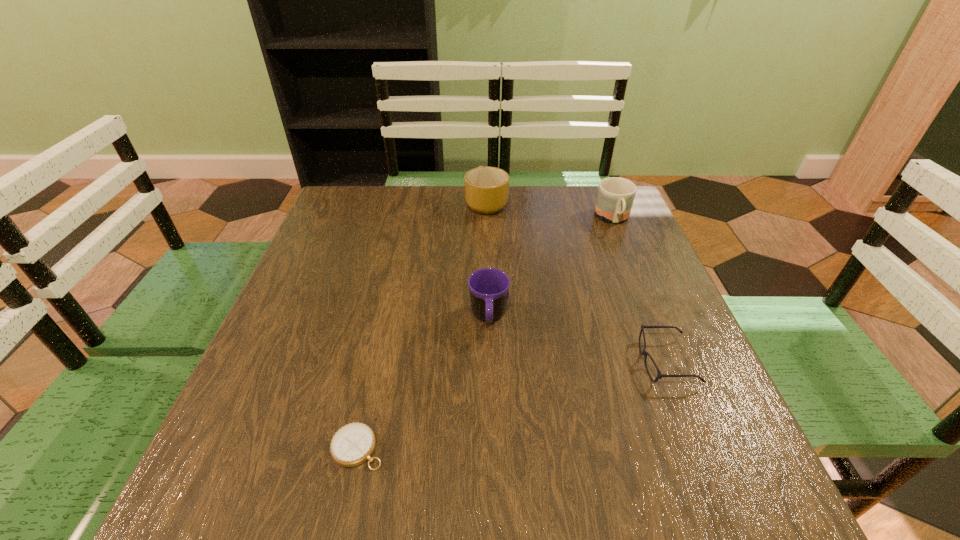
Find the location of a particular element. The height and width of the screenshot is (540, 960). the rightmost mug is located at coordinates (615, 197).

Where is `the nearest mug`? the nearest mug is located at coordinates [x=489, y=292].

Image resolution: width=960 pixels, height=540 pixels. In order to click on spectacles in this screenshot , I will do `click(645, 353)`.

Identify the location of the shortest object. The image size is (960, 540). (353, 444).

Where is `the leftmost object`? The image size is (960, 540). the leftmost object is located at coordinates (353, 444).

Identify the location of vacant space situated 0.240m on the side with the handle of the rightmost mug. The image size is (960, 540). (643, 294).

Where is `vacant space located 0.110m with the handle on the side of the nearest mug`? Image resolution: width=960 pixels, height=540 pixels. vacant space located 0.110m with the handle on the side of the nearest mug is located at coordinates (490, 384).

The height and width of the screenshot is (540, 960). Find the location of `vacant area located 0.170m on the front-facing side of the fourth tallest object`. vacant area located 0.170m on the front-facing side of the fourth tallest object is located at coordinates (551, 362).

You are a GUI agent. You are given a task and a screenshot of the screen. Output one action in this format:
    pyautogui.click(x=<x>, y=<y>)
    Task: Click on the free space located 0.110m on the front-facing side of the fourth tallest object
    The image size is (960, 540).
    Given the screenshot: What is the action you would take?
    pyautogui.click(x=582, y=362)

At what (x,y) coordinates should I click in order to perform the action: click on vacant space located on the front-facing side of the fourth tallest object. Please return your answer as a coordinate pair (x, y). This screenshot has width=960, height=540. Looking at the image, I should click on (566, 362).